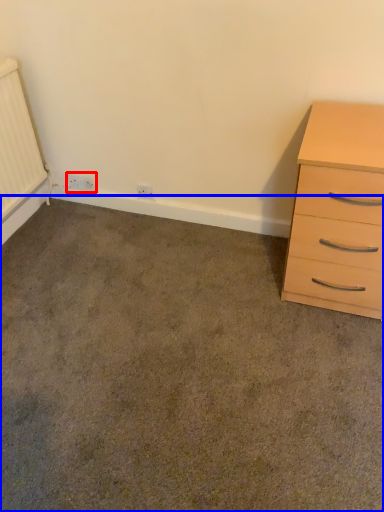
Question: Which of the following is the closest to the observer, electric outlet (highlighted by a red box) or concrete (highlighted by a blue box)?

Choices:
 (A) electric outlet
 (B) concrete

Answer: (B)